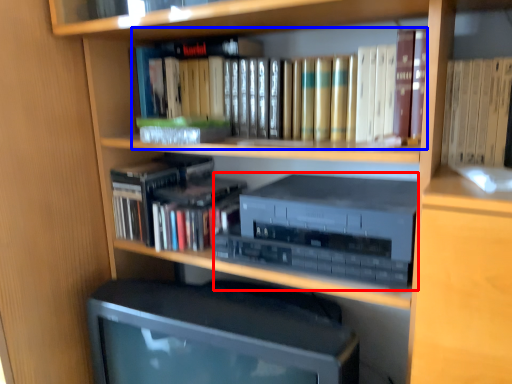
Question: Which object appears farthest to the camera in this image, stereo (highlighted by a red box) or book (highlighted by a blue box)?

Choices:
 (A) stereo
 (B) book

Answer: (B)